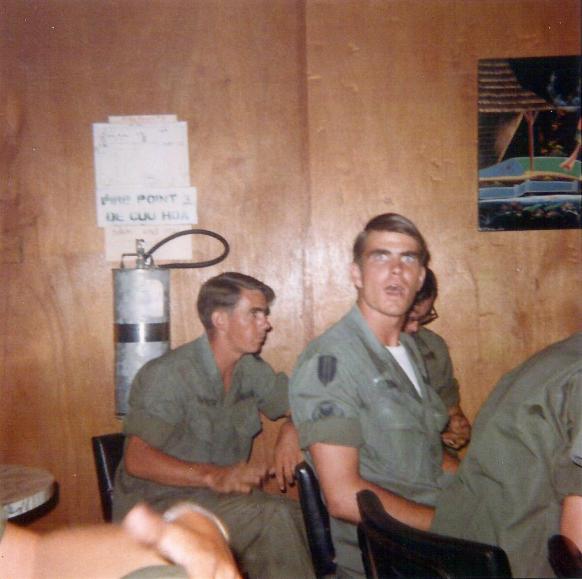
The width and height of the screenshot is (582, 579). I want to click on poster, so click(526, 131).